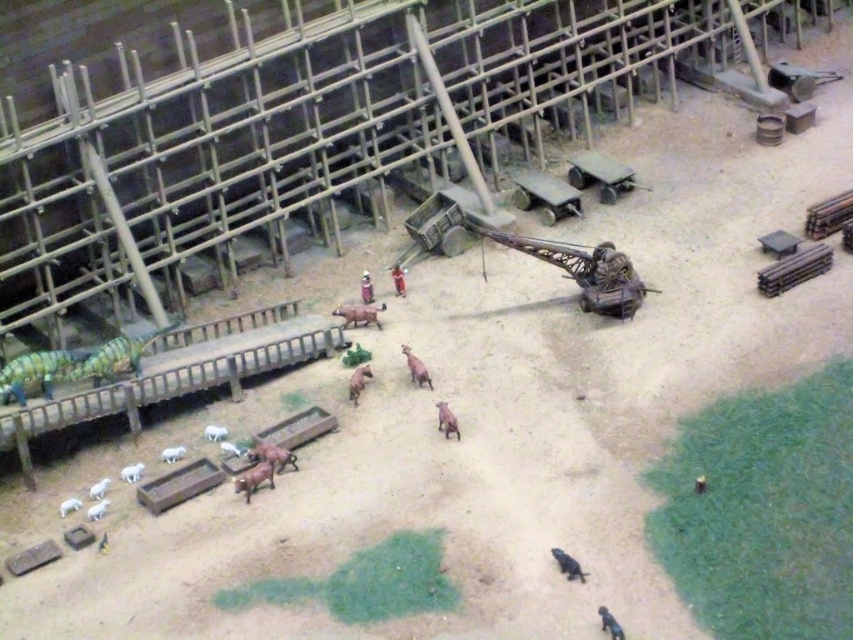
You are a model maker observing the diorama. You need to place a new small flag that is 3 inches tall. The flag must be placed so it is taller than both the smooth plastic figure at center and the smooth brown figure at center. Is this possible?

The smooth plastic figure at center has a greater height compared to smooth brown figure at center. Since the flag is 3 inches tall, it can only be placed if it exceeds the height of the taller figure, which is the smooth plastic figure at center. However, the flag itself is only 3 inches tall, so unless the plastic figure is shorter than 3 inches, this isn

In the scene shown: You are a visitor observing the diorama and want to find the smooth plastic figure at center and the smooth brown figure at center. Which one is located to the left when viewed from your perspective?

The smooth plastic figure at center is positioned on the left side of the smooth brown figure at center, so when viewed from your perspective, the smooth plastic figure at center is to the left.